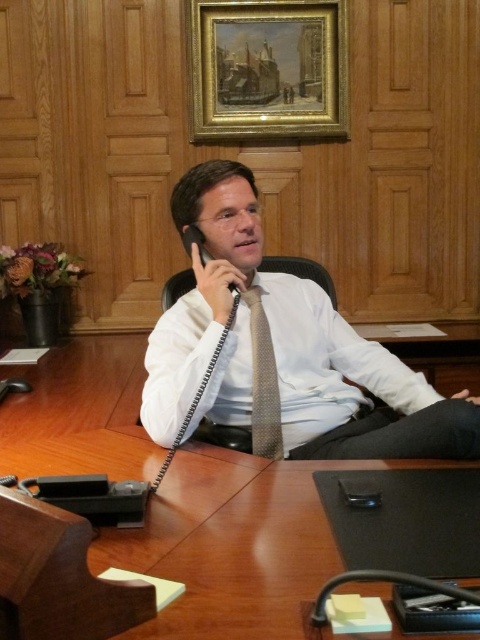
From the picture: Is wooden table at center taller than white textured shirt at center?

No, wooden table at center is not taller than white textured shirt at center.

Can you confirm if wooden table at center is positioned to the right of white textured shirt at center?

No, wooden table at center is not to the right of white textured shirt at center.

Where is `wooden table at center`? This screenshot has height=640, width=480. wooden table at center is located at coordinates (235, 545).

I want to click on wooden table at center, so click(235, 545).

Where is `light brown textured tie at center`? light brown textured tie at center is located at coordinates (263, 381).

Can you confirm if light brown textured tie at center is thinner than black plastic phone at center?

Correct, light brown textured tie at center's width is less than black plastic phone at center's.

You are a GUI agent. You are given a task and a screenshot of the screen. Output one action in this format:
    pyautogui.click(x=<x>, y=<y>)
    Task: Click on the light brown textured tie at center
    The image size is (480, 640).
    Given the screenshot: What is the action you would take?
    pyautogui.click(x=263, y=381)

Does light brown textured tie at center appear under black plastic smartphone at lower center?

Actually, light brown textured tie at center is above black plastic smartphone at lower center.

In the scene shown: Is light brown textured tie at center to the right of black plastic smartphone at lower center from the viewer's perspective?

In fact, light brown textured tie at center is to the left of black plastic smartphone at lower center.

Between point (256, 348) and point (337, 480), which one is positioned behind?

Positioned behind is point (256, 348).

The width and height of the screenshot is (480, 640). Identify the location of light brown textured tie at center. (263, 381).